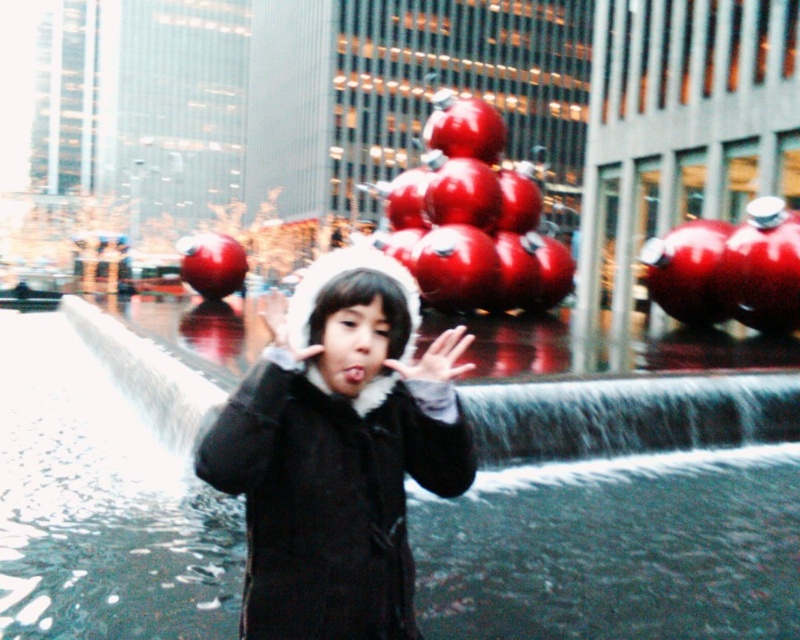
Describe the element at coordinates (336, 458) in the screenshot. I see `matte black coat at center` at that location.

From the picture: Is matte black coat at center in front of white fluffy hand at center?

Yes, it is in front of white fluffy hand at center.

Which is behind, point (384, 579) or point (429, 346)?

The point (429, 346) is more distant.

I want to click on matte black coat at center, so click(336, 458).